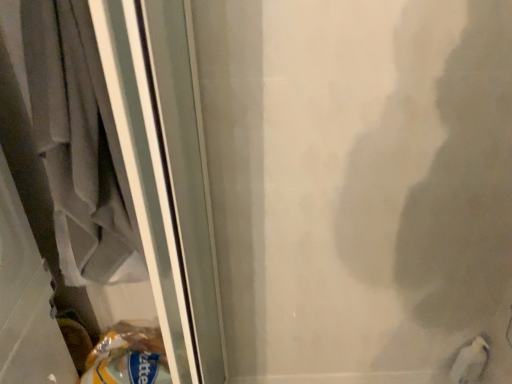
Where is `white matte bird at lower right`? This screenshot has width=512, height=384. white matte bird at lower right is located at coordinates (470, 362).

What do you see at coordinates (470, 362) in the screenshot?
I see `white matte bird at lower right` at bounding box center [470, 362].

What do you see at coordinates (80, 143) in the screenshot? The width and height of the screenshot is (512, 384). I see `gray fabric laundry at left` at bounding box center [80, 143].

The height and width of the screenshot is (384, 512). Identify the location of gray fabric laundry at left. (80, 143).

What are the coordinates of `white matte bird at lower right` in the screenshot? It's located at (470, 362).

Is gray fabric laundry at left at the left side of white matte bird at lower right?

Yes, gray fabric laundry at left is to the left of white matte bird at lower right.

Is gray fabric laundry at left positioned in front of white matte bird at lower right?

Yes.

Does point (125, 210) lie in front of point (461, 382)?

Yes, point (125, 210) is in front of point (461, 382).

From the image's perspective, is gray fabric laundry at left positioned above or below white matte bird at lower right?

gray fabric laundry at left is situated higher than white matte bird at lower right in the image.

From a real-world perspective, who is located higher, gray fabric laundry at left or white matte bird at lower right?

gray fabric laundry at left is physically above.

Considering the relative sizes of gray fabric laundry at left and white matte bird at lower right in the image provided, is gray fabric laundry at left thinner than white matte bird at lower right?

In fact, gray fabric laundry at left might be wider than white matte bird at lower right.

Considering the relative sizes of gray fabric laundry at left and white matte bird at lower right in the image provided, is gray fabric laundry at left taller than white matte bird at lower right?

Yes, gray fabric laundry at left is taller than white matte bird at lower right.

Considering the sizes of objects gray fabric laundry at left and white matte bird at lower right in the image provided, who is bigger, gray fabric laundry at left or white matte bird at lower right?

With larger size is gray fabric laundry at left.

Is gray fabric laundry at left not within white matte bird at lower right?

That's correct, gray fabric laundry at left is outside of white matte bird at lower right.

Are gray fabric laundry at left and white matte bird at lower right far apart?

Absolutely, gray fabric laundry at left is distant from white matte bird at lower right.

Is gray fabric laundry at left turned away from white matte bird at lower right?

No, gray fabric laundry at left is not facing the opposite direction of white matte bird at lower right.

How much distance is there between gray fabric laundry at left and white matte bird at lower right?

gray fabric laundry at left is 1.20 meters away from white matte bird at lower right.

You are a GUI agent. You are given a task and a screenshot of the screen. Output one action in this format:
    pyautogui.click(x=<x>, y=<y>)
    Task: Click on the animal behind the gray fabric laundry at left
    The image size is (512, 384).
    Given the screenshot: What is the action you would take?
    pyautogui.click(x=470, y=362)

Between white matte bird at lower right and gray fabric laundry at left, which one appears on the left side from the viewer's perspective?

Positioned to the left is gray fabric laundry at left.

Considering the positions of objects white matte bird at lower right and gray fabric laundry at left in the image provided, who is behind, white matte bird at lower right or gray fabric laundry at left?

white matte bird at lower right.

Is point (473, 347) farther from camera compared to point (133, 263)?

Yes.

From the image's perspective, between white matte bird at lower right and gray fabric laundry at left, who is located below?

white matte bird at lower right is shown below in the image.

Based on the photo, from a real-world perspective, between white matte bird at lower right and gray fabric laundry at left, who is vertically lower?

white matte bird at lower right, from a real-world perspective.

Looking at this image, does white matte bird at lower right have a lesser width compared to gray fabric laundry at left?

Indeed, white matte bird at lower right has a lesser width compared to gray fabric laundry at left.

Considering the sizes of objects white matte bird at lower right and gray fabric laundry at left in the image provided, who is taller, white matte bird at lower right or gray fabric laundry at left?

Standing taller between the two is gray fabric laundry at left.

Is white matte bird at lower right smaller than gray fabric laundry at left?

Correct, white matte bird at lower right occupies less space than gray fabric laundry at left.

Is gray fabric laundry at left a part of white matte bird at lower right?

No, gray fabric laundry at left is not surrounded by white matte bird at lower right.

Is white matte bird at lower right placed right next to gray fabric laundry at left?

white matte bird at lower right is not next to gray fabric laundry at left, and they're not touching.

Is white matte bird at lower right turned away from gray fabric laundry at left?

No, white matte bird at lower right is not facing away from gray fabric laundry at left.

From the picture: Can you tell me how much white matte bird at lower right and gray fabric laundry at left differ in facing direction?

90 degrees separate the facing orientations of white matte bird at lower right and gray fabric laundry at left.

Identify the location of laundry that appears on the left of white matte bird at lower right. (80, 143).

You are a GUI agent. You are given a task and a screenshot of the screen. Output one action in this format:
    pyautogui.click(x=<x>, y=<y>)
    Task: Click on the animal behind the gray fabric laundry at left
    The width and height of the screenshot is (512, 384).
    Given the screenshot: What is the action you would take?
    pyautogui.click(x=470, y=362)

Where is `animal below the gray fabric laundry at left (from a real-world perspective)`? This screenshot has height=384, width=512. animal below the gray fabric laundry at left (from a real-world perspective) is located at coordinates (470, 362).